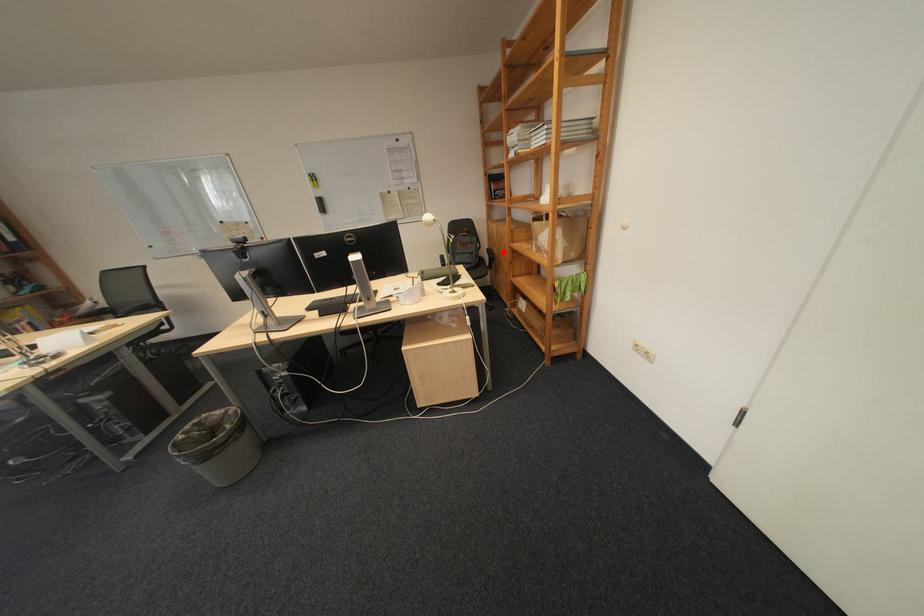
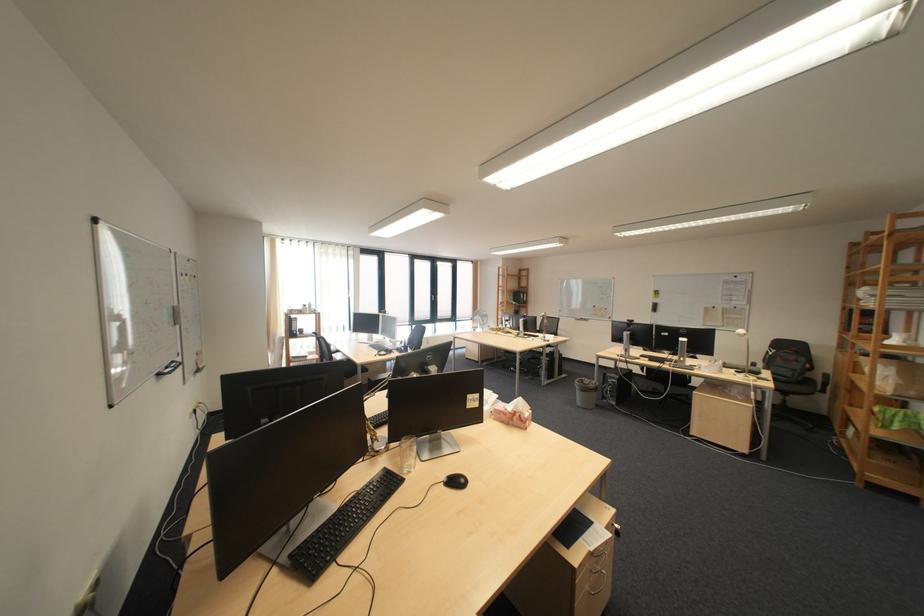
Question: I am providing you with two images of the same scene from different viewpoints. Given a red point in image1, look at the same physical point in image2. Is it:

Choices:
 (A) Closer to the viewpoint
 (B) Farther from the viewpoint

Answer: (B)